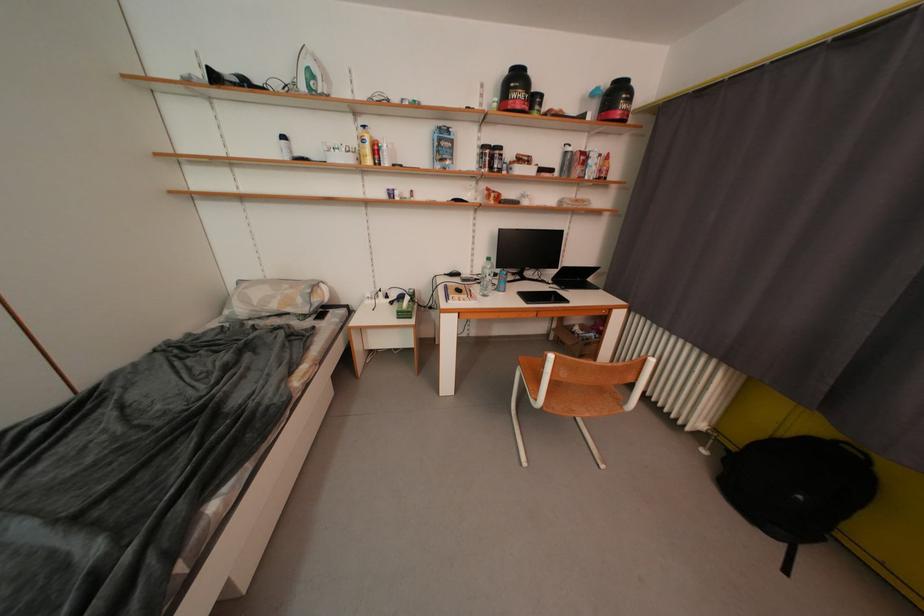
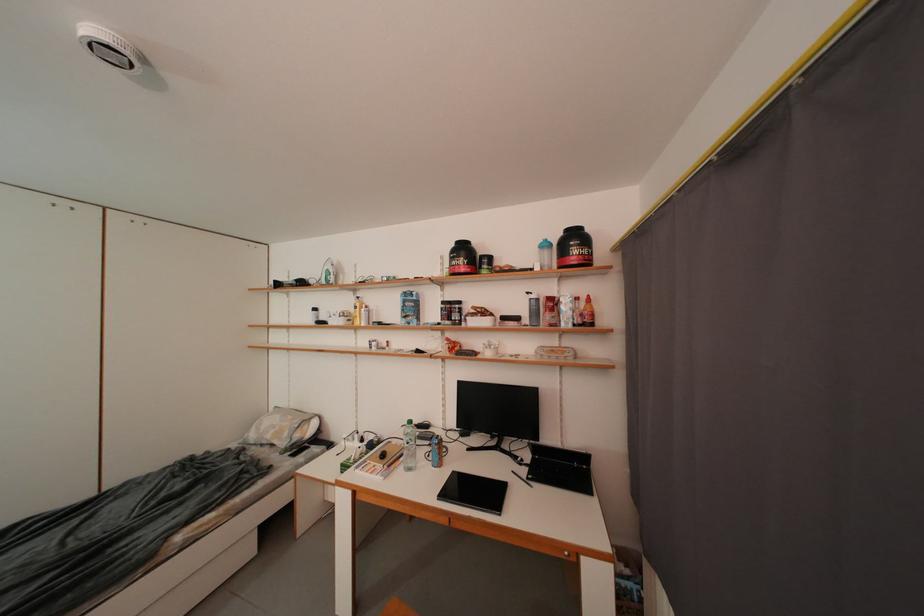
Question: I am providing you with two images of the same scene from different viewpoints. After the viewpoint changes to image2, which objects are now occluded?

Choices:
 (A) white steam iron
 (B) white cabinet handle
 (C) black computer mouse
 (D) none of these

Answer: (D)